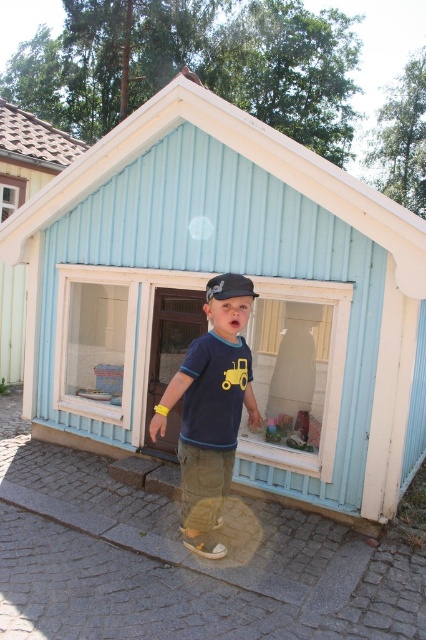
Question: Is matte blue shirt at center wider than black fabric baseball cap at center?

Choices:
 (A) yes
 (B) no

Answer: (A)

Question: Does light blue wood at center appear on the left side of light blue wood at upper left?

Choices:
 (A) no
 (B) yes

Answer: (A)

Question: Can you confirm if light blue wood at upper left is positioned to the left of black fabric baseball cap at center?

Choices:
 (A) yes
 (B) no

Answer: (A)

Question: Considering the real-world distances, which object is farthest from the light blue wood at center?

Choices:
 (A) light blue wood at upper left
 (B) matte blue shirt at center
 (C) black fabric baseball cap at center

Answer: (A)

Question: Among these points, which one is farthest from the camera?

Choices:
 (A) (242, 291)
 (B) (227, 458)
 (C) (58, 188)
 (D) (2, 288)

Answer: (D)

Question: Which point appears farthest from the camera in this image?

Choices:
 (A) (89, 436)
 (B) (209, 285)
 (C) (2, 365)

Answer: (C)